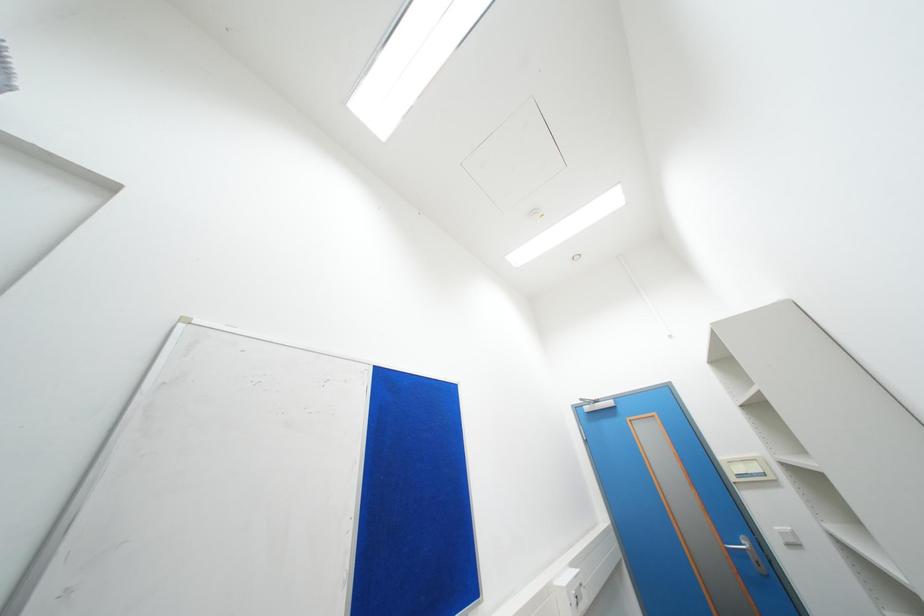
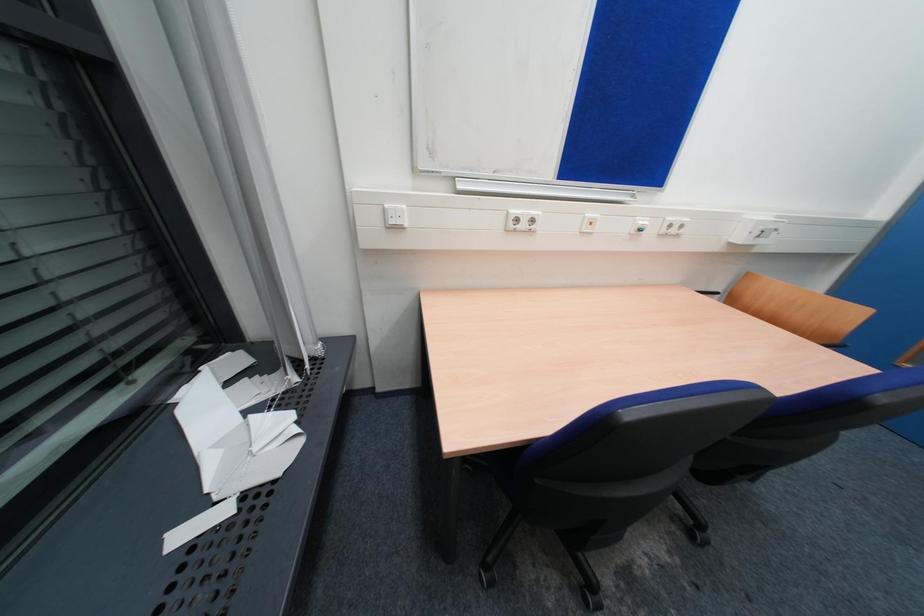
The images are taken continuously from a first-person perspective. In which direction is your viewpoint rotating?

The camera's rotation is toward left-down.